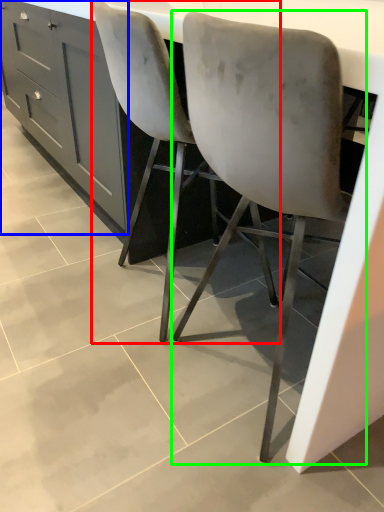
Question: Which is nearer to the chair (highlighted by a red box)? cabinetry (highlighted by a blue box) or chair (highlighted by a green box).

Choices:
 (A) cabinetry
 (B) chair

Answer: (B)